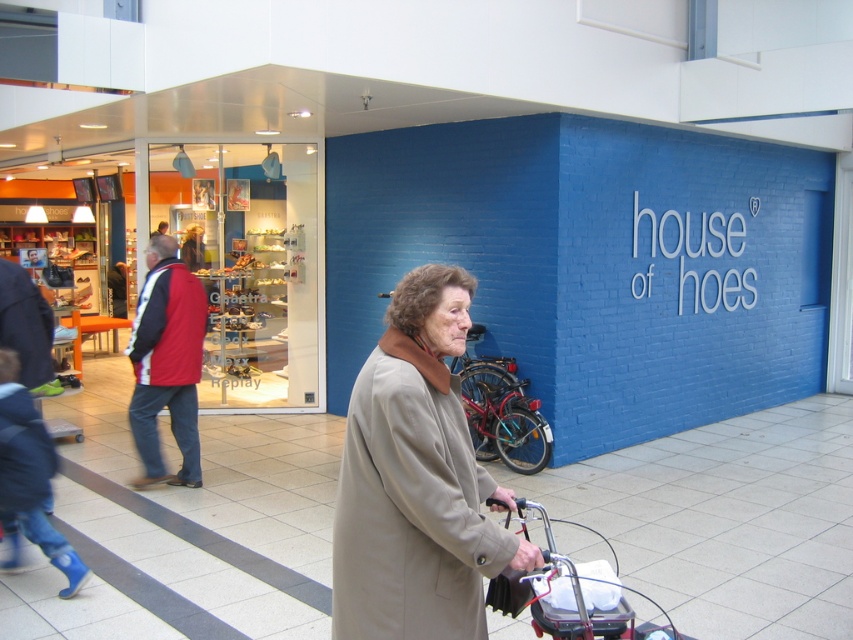
You are a customer in the mall and want to buy a jacket. You see the matte glass shoe display at left and the red jacket at left. Which object is closer to the entrance of the store?

The matte glass shoe display at left is to the left of the red jacket at left, so the red jacket at left is closer to the entrance of the store.

You are standing in the shopping mall and want to take a photo of the blue brick wall with the text. However, you need to ensure that both the red bicycle leaning against the wall and the matte glass shoe display at left are visible in the frame. Given their positions, can you fit both objects into your camera view without moving your position?

The matte glass shoe display at left is 5.92 meters away from viewer, so it is farther away than the red bicycle leaning against the wall. Since the shoe display is further back, it should be visible in the background while the bicycle is in the foreground, allowing both to be captured in the same frame if the camera has a wide enough angle.

From the picture: You are a delivery person who needs to place a large package between the matte glass shoe display at left and the red jacket at left. The package is 3 meters long. Will it fit between them?

The distance between the matte glass shoe display at left and the red jacket at left is 3.24 meters, so the 3 meter long package will fit between them.